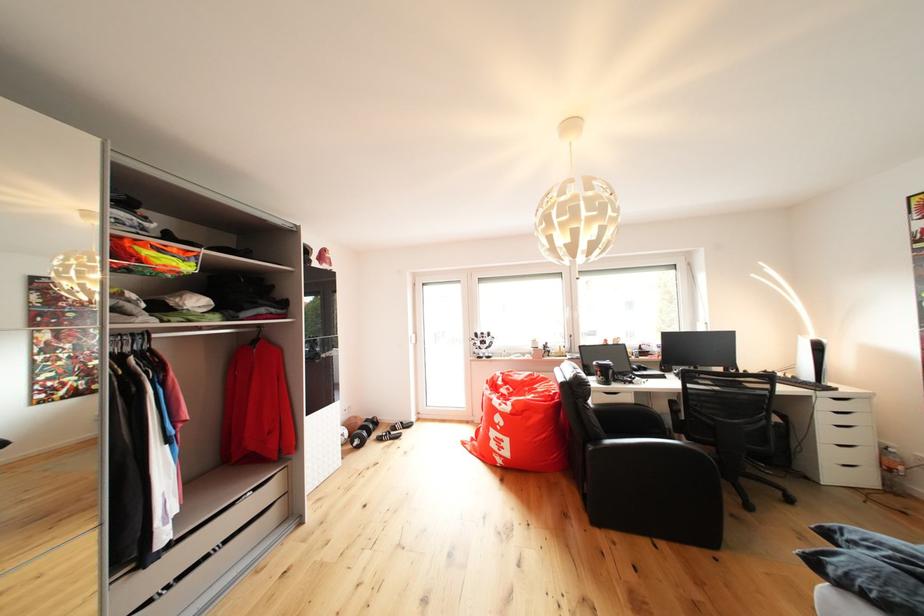
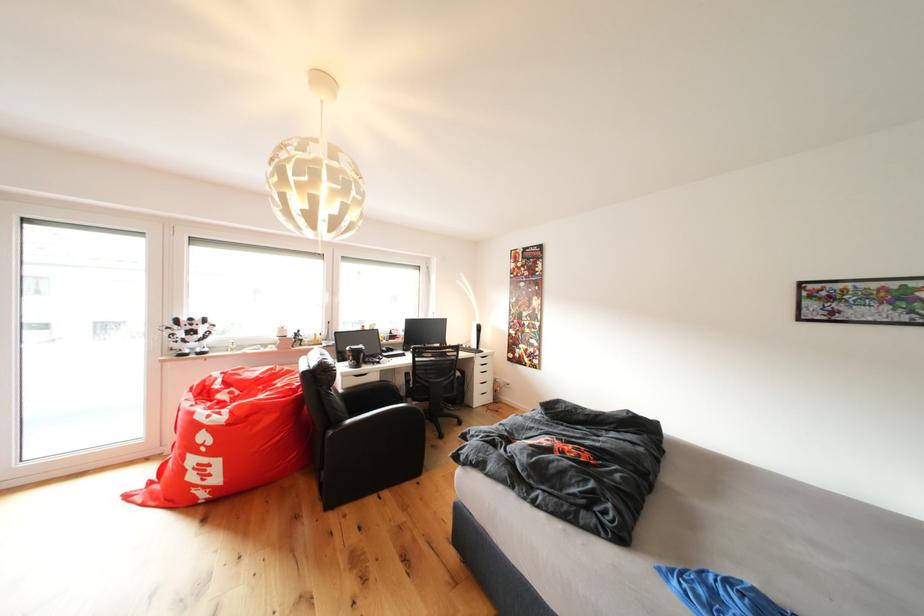
In the second image, find the point that corresponds to point 833,408 in the first image.

(487, 366)